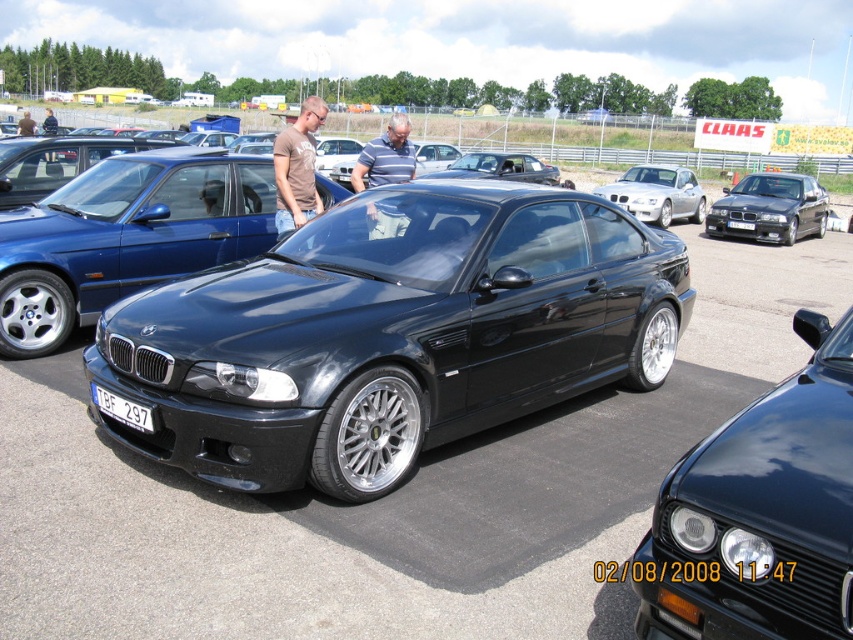
You are a photographer at the car exhibition and need to take a photo of the blue striped polo shirt at center and the satin black car at center. Which object is covering the other one in the image?

The blue striped polo shirt at center is positioned over the satin black car at center, so it is covering the car in the image.

You are a photographer standing in front of the black BMW M3 at the car exhibition. You notice a blue striped polo shirt at center and a white plastic license plate at center. Which object is nearer to your camera lens?

The blue striped polo shirt at center is closer to the viewer than the white plastic license plate at center, so the blue striped polo shirt at center is nearer to your camera lens.

You are a photographer at the car exhibition and want to take a photo of the glossy black car at center and the blue striped polo shirt at center. Which object is taller so that you can adjust your camera angle accordingly?

The blue striped polo shirt at center is taller than the glossy black car at center, so you should adjust your camera angle to focus on the taller object first.